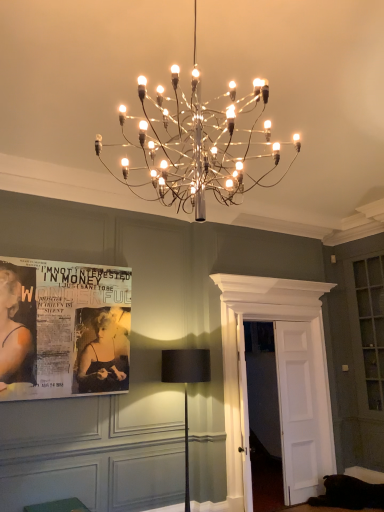
Question: From a real-world perspective, is black fabric lamp at center, which is the second lamp in front-to-back order, on top of black paper poster at left?

Choices:
 (A) yes
 (B) no

Answer: (B)

Question: Is black fabric lamp at center, which is the second lamp in front-to-back order, positioned in front of black paper poster at left?

Choices:
 (A) yes
 (B) no

Answer: (A)

Question: Considering the relative sizes of black fabric lamp at center, which is the second lamp in front-to-back order, and black paper poster at left in the image provided, is black fabric lamp at center, which is the second lamp in front-to-back order, smaller than black paper poster at left?

Choices:
 (A) yes
 (B) no

Answer: (B)

Question: Is black fabric lamp at center, which is counted as the first lamp, starting from the bottom, facing away from black paper poster at left?

Choices:
 (A) yes
 (B) no

Answer: (B)

Question: Is black fabric lamp at center, marked as the second lamp in a top-to-bottom arrangement, far away from black paper poster at left?

Choices:
 (A) no
 (B) yes

Answer: (B)

Question: Is black fabric lamp at center, marked as the second lamp in a top-to-bottom arrangement, at the left side of black paper poster at left?

Choices:
 (A) yes
 (B) no

Answer: (B)

Question: From a real-world perspective, is black paper poster at left located beneath metallic wire chandelier at upper center, which is the 2th lamp in bottom-to-top order?

Choices:
 (A) no
 (B) yes

Answer: (B)

Question: Can you confirm if black paper poster at left is positioned to the right of metallic wire chandelier at upper center, the second lamp in the back-to-front sequence?

Choices:
 (A) yes
 (B) no

Answer: (B)

Question: Does black paper poster at left touch metallic wire chandelier at upper center, the second lamp in the back-to-front sequence?

Choices:
 (A) yes
 (B) no

Answer: (B)

Question: Is metallic wire chandelier at upper center, which is the 2th lamp in bottom-to-top order, at the back of black paper poster at left?

Choices:
 (A) yes
 (B) no

Answer: (B)

Question: Would you say black paper poster at left contains metallic wire chandelier at upper center, the second lamp in the back-to-front sequence?

Choices:
 (A) yes
 (B) no

Answer: (B)

Question: Does black paper poster at left turn towards metallic wire chandelier at upper center, the 1th lamp when ordered from top to bottom?

Choices:
 (A) yes
 (B) no

Answer: (A)

Question: From the image's perspective, would you say green fabric cushion at lower left is positioned over metallic wire chandelier at upper center, the 1th lamp when ordered from top to bottom?

Choices:
 (A) yes
 (B) no

Answer: (B)